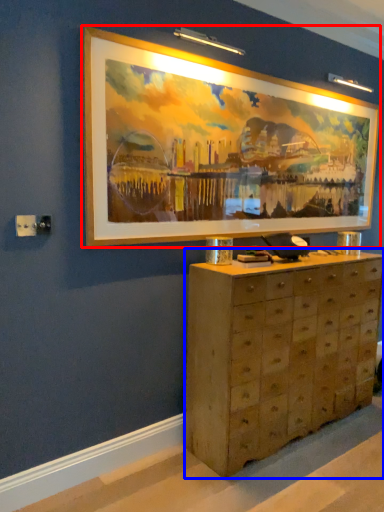
Question: Which point is further to the camera, picture frame (highlighted by a red box) or chest of drawers (highlighted by a blue box)?

Choices:
 (A) picture frame
 (B) chest of drawers

Answer: (B)